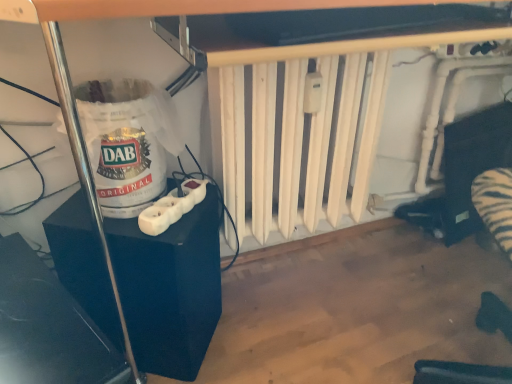
Question: Is glossy plastic speaker at lower left at the right side of black plastic power strip at left?

Choices:
 (A) no
 (B) yes

Answer: (A)

Question: Considering the relative positions of glossy plastic speaker at lower left and black plastic power strip at left in the image provided, is glossy plastic speaker at lower left in front of black plastic power strip at left?

Choices:
 (A) yes
 (B) no

Answer: (A)

Question: Is glossy plastic speaker at lower left wider than black plastic power strip at left?

Choices:
 (A) no
 (B) yes

Answer: (B)

Question: Could black plastic power strip at left be considered to be inside glossy plastic speaker at lower left?

Choices:
 (A) yes
 (B) no

Answer: (B)

Question: Is glossy plastic speaker at lower left facing away from black plastic power strip at left?

Choices:
 (A) no
 (B) yes

Answer: (A)

Question: Is point (121, 107) positioned closer to the camera than point (159, 203)?

Choices:
 (A) closer
 (B) farther

Answer: (A)

Question: Is white paper bag at left wider or thinner than white plastic wii controller at lower left?

Choices:
 (A) wide
 (B) thin

Answer: (A)

Question: From a real-world perspective, is white paper bag at left physically located above or below white plastic wii controller at lower left?

Choices:
 (A) above
 (B) below

Answer: (A)

Question: Considering the positions of white paper bag at left and white plastic wii controller at lower left in the image, is white paper bag at left taller or shorter than white plastic wii controller at lower left?

Choices:
 (A) tall
 (B) short

Answer: (A)

Question: From the image's perspective, is white matte radiator at center positioned above or below glossy plastic speaker at lower left?

Choices:
 (A) below
 (B) above

Answer: (B)

Question: Is white matte radiator at center in front of or behind glossy plastic speaker at lower left in the image?

Choices:
 (A) front
 (B) behind

Answer: (B)

Question: Based on their sizes in the image, would you say white matte radiator at center is bigger or smaller than glossy plastic speaker at lower left?

Choices:
 (A) big
 (B) small

Answer: (A)

Question: Is white matte radiator at center taller or shorter than glossy plastic speaker at lower left?

Choices:
 (A) short
 (B) tall

Answer: (B)

Question: Considering the positions of black plastic power strip at left and white plastic wii controller at lower left in the image, is black plastic power strip at left bigger or smaller than white plastic wii controller at lower left?

Choices:
 (A) big
 (B) small

Answer: (A)

Question: From the image's perspective, is black plastic power strip at left located above or below white plastic wii controller at lower left?

Choices:
 (A) below
 (B) above

Answer: (A)